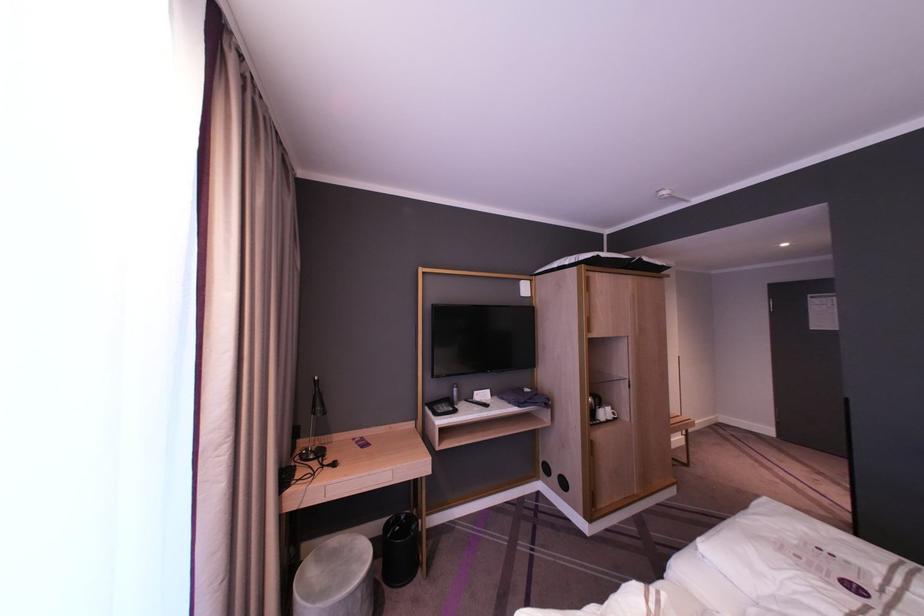
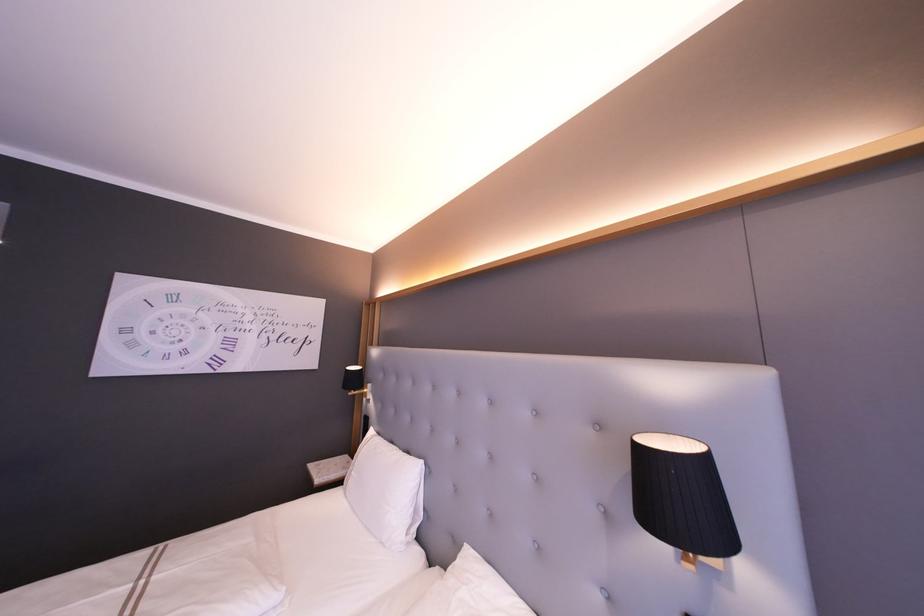
Question: The first image is from the beginning of the video and the second image is from the end. How did the camera likely rotate when shooting the video?

Choices:
 (A) Left
 (B) Right
 (C) Up
 (D) Down

Answer: (B)